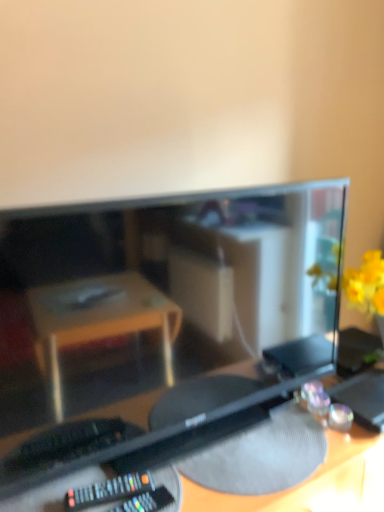
At what (x,y) coordinates should I click in order to perform the action: click on black plastic remote at lower left. Please return your answer as a coordinate pair (x, y). The width and height of the screenshot is (384, 512). Looking at the image, I should click on (108, 490).

Locate an element on the screen. This screenshot has height=512, width=384. matte black monitor at center is located at coordinates (162, 317).

Locate an element on the screen. The image size is (384, 512). black plastic remote at lower left is located at coordinates (108, 490).

Is black plastic desk at center looking in the opposite direction of black plastic remote at lower left?

black plastic desk at center does not have its back to black plastic remote at lower left.

How far apart are black plastic desk at center and black plastic remote at lower left?

black plastic desk at center and black plastic remote at lower left are 10.76 inches apart from each other.

Which of these two, black plastic desk at center or black plastic remote at lower left, stands taller?

black plastic desk at center.

Looking at this image, which object is closer to the camera taking this photo, black plastic desk at center or black plastic remote at lower left?

Positioned in front is black plastic desk at center.

From a real-world perspective, is matte black monitor at center positioned under black plastic remote at lower left based on gravity?

No, from a real-world perspective, matte black monitor at center is not below black plastic remote at lower left.

Looking at their sizes, would you say matte black monitor at center is wider or thinner than black plastic remote at lower left?

matte black monitor at center is wider than black plastic remote at lower left.

Does matte black monitor at center have a larger size compared to black plastic remote at lower left?

Correct, matte black monitor at center is larger in size than black plastic remote at lower left.

How many degrees apart are the facing directions of matte black monitor at center and black plastic remote at lower left?

The facing directions of matte black monitor at center and black plastic remote at lower left are 11.6 degrees apart.

Does point (79, 488) come behind point (346, 460)?

No, (79, 488) is in front of (346, 460).

Is black plastic remote at lower left not near black plastic desk at center?

No, black plastic remote at lower left is not far from black plastic desk at center.

Can you confirm if black plastic remote at lower left is wider than black plastic desk at center?

In fact, black plastic remote at lower left might be narrower than black plastic desk at center.

Can you confirm if black plastic remote at lower left is smaller than black plastic desk at center?

Yes, black plastic remote at lower left is smaller than black plastic desk at center.

In terms of height, does black plastic remote at lower left look taller or shorter compared to matte black monitor at center?

black plastic remote at lower left is shorter than matte black monitor at center.

From the image's perspective, is black plastic remote at lower left located above or below matte black monitor at center?

black plastic remote at lower left is situated lower than matte black monitor at center in the image.

Are black plastic remote at lower left and matte black monitor at center making contact?

Answer: No, black plastic remote at lower left is not touching matte black monitor at center.

Considering the points (137, 483) and (164, 355), which point is in front, point (137, 483) or point (164, 355)?

The point (137, 483) is closer to the camera.

Is black plastic desk at center beside matte black monitor at center?

No, black plastic desk at center is not making contact with matte black monitor at center.

Considering the sizes of objects black plastic desk at center and matte black monitor at center in the image provided, who is shorter, black plastic desk at center or matte black monitor at center?

matte black monitor at center is shorter.

Considering the relative sizes of black plastic desk at center and matte black monitor at center in the image provided, is black plastic desk at center thinner than matte black monitor at center?

In fact, black plastic desk at center might be wider than matte black monitor at center.

Is black plastic desk at center aimed at matte black monitor at center?

No, black plastic desk at center does not turn towards matte black monitor at center.

From their relative heights in the image, would you say matte black monitor at center is taller or shorter than black plastic desk at center?

matte black monitor at center is shorter than black plastic desk at center.

From the image's perspective, which is below, matte black monitor at center or black plastic desk at center?

black plastic desk at center.

From a real-world perspective, which object stands above the other?

matte black monitor at center, from a real-world perspective.

Is matte black monitor at center not within black plastic desk at center?

Absolutely, matte black monitor at center is external to black plastic desk at center.

At what (x,y) coordinates should I click in order to perform the action: click on control on the left of black plastic desk at center. Please return your answer as a coordinate pair (x, y). Looking at the image, I should click on [x=108, y=490].

The width and height of the screenshot is (384, 512). Identify the location of computer monitor above the black plastic remote at lower left (from a real-world perspective). (162, 317).

Estimate the real-world distances between objects in this image. Which object is closer to black plastic desk at center, matte black monitor at center or black plastic remote at lower left?

matte black monitor at center is closer to black plastic desk at center.

From the image, which object appears to be nearer to black plastic desk at center, black plastic remote at lower left or matte black monitor at center?

matte black monitor at center lies closer to black plastic desk at center than the other object.

Consider the image. From the image, which object appears to be farther from black plastic remote at lower left, black plastic desk at center or matte black monitor at center?

matte black monitor at center lies further to black plastic remote at lower left than the other object.

Which object lies further to the anchor point matte black monitor at center, black plastic remote at lower left or black plastic desk at center?

black plastic remote at lower left.

Which object lies further to the anchor point black plastic remote at lower left, matte black monitor at center or black plastic desk at center?

matte black monitor at center is positioned further to the anchor black plastic remote at lower left.

Looking at the image, which one is located further to matte black monitor at center, black plastic desk at center or black plastic remote at lower left?

black plastic remote at lower left is further to matte black monitor at center.

The image size is (384, 512). I want to click on control between matte black monitor at center and black plastic desk at center in the vertical direction, so coord(108,490).